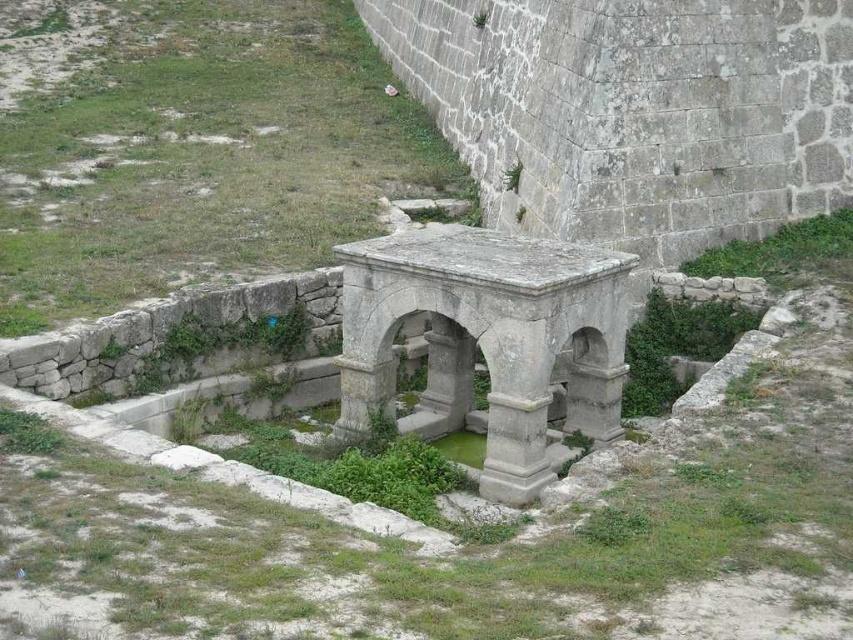
You are a tourist standing in the courtyard of the ancient stone structure. You see the gray stone fountain at center and the gray stone column at center. Which one is positioned to the left when facing the structure?

The gray stone fountain at center is positioned to the left of the gray stone column at center.

You are an archaeologist examining the ancient stone structure. You need to determine if the gray stone fountain at center can be moved to the location currently occupied by the gray stone column at center. Based on their sizes, is this feasible?

The gray stone fountain at center might be wider than gray stone column at center, so moving the fountain to the column location may not be feasible if the space is limited.